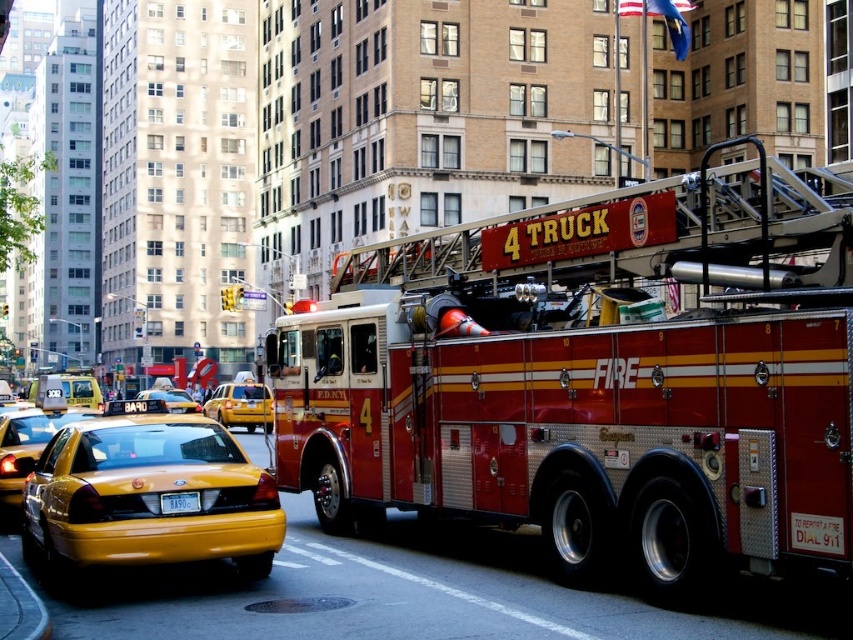
You are a photographer standing in front of the red fire truck and want to take a photo that includes both the point at coordinates point (131, 512) and point (248, 417). Which point will appear larger in your photo?

Point (131, 512) is closer to the camera than point (248, 417), so it will appear larger in the photo.

You are a pedestrian standing on the sidewalk and see the yellow rubber taxi at center and the yellow plastic license plate at lower center. Which object is closer to you?

The yellow plastic license plate at lower center is closer to you because it is above the yellow rubber taxi at center, which is positioned under it.

You are a pedestrian standing on the sidewalk and want to cross the street. There are two yellow taxis in front of you. The yellow matte taxi at lower left and the yellow rubber taxi cab at center. Which taxi is wider so you can wait under it for shelter during a sudden rain?

The yellow rubber taxi cab at center is wider than the yellow matte taxi at lower left, so you should wait under the yellow rubber taxi cab at center for shelter.